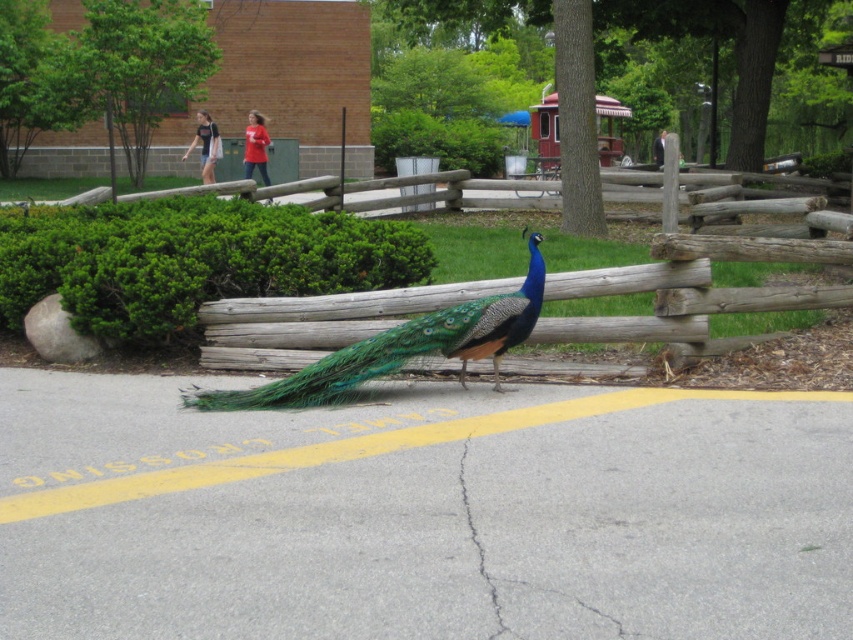
This screenshot has width=853, height=640. Describe the element at coordinates (668, 307) in the screenshot. I see `wooden fence at center` at that location.

Measure the distance from wooden fence at center to shiny blue peacock at center.

wooden fence at center is 36.81 inches away from shiny blue peacock at center.

Between point (560, 323) and point (496, 381), which one is positioned in front?

Point (496, 381)

At what (x,y) coordinates should I click in order to perform the action: click on wooden fence at center. Please return your answer as a coordinate pair (x, y). Looking at the image, I should click on (668, 307).

Does shiny blue peacock at center have a lesser width compared to gray concrete crack at center?

No.

Does shiny blue peacock at center appear on the right side of gray concrete crack at center?

Incorrect, shiny blue peacock at center is not on the right side of gray concrete crack at center.

Which is behind, point (287, 376) or point (500, 627)?

Positioned behind is point (287, 376).

The height and width of the screenshot is (640, 853). Identify the location of shiny blue peacock at center. (401, 348).

Measure the distance between wooden fence at center and gray concrete crack at center.

wooden fence at center is 2.83 meters away from gray concrete crack at center.

Can you confirm if wooden fence at center is bigger than gray concrete crack at center?

Correct, wooden fence at center is larger in size than gray concrete crack at center.

The image size is (853, 640). Find the location of `wooden fence at center`. wooden fence at center is located at coordinates (668, 307).